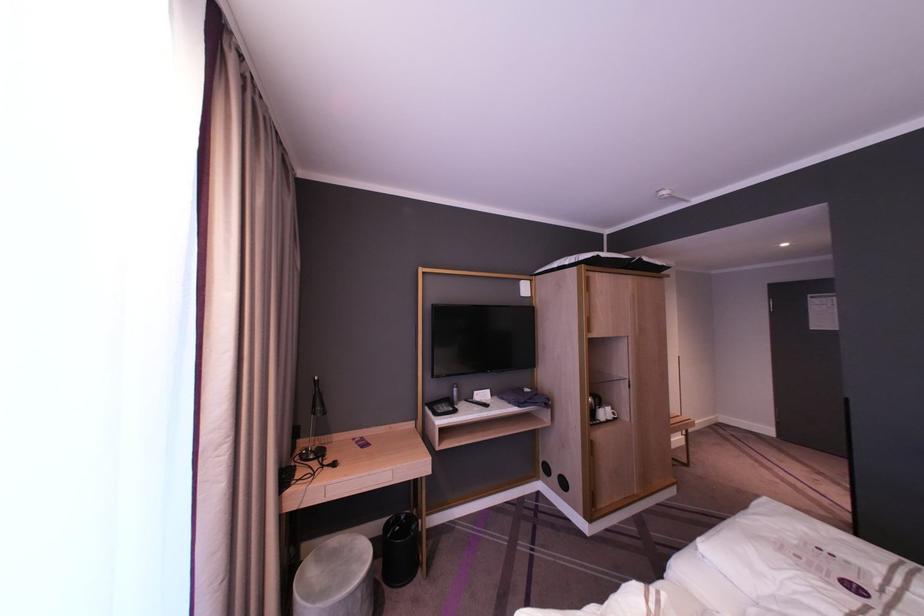
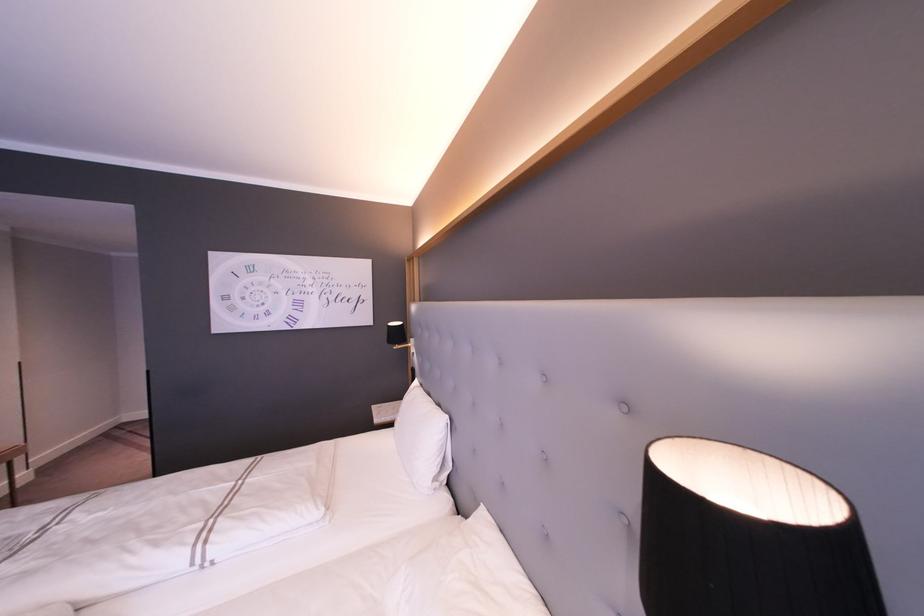
Question: The first image is from the beginning of the video and the second image is from the end. How did the camera likely rotate when shooting the video?

Choices:
 (A) Left
 (B) Right
 (C) Up
 (D) Down

Answer: (B)